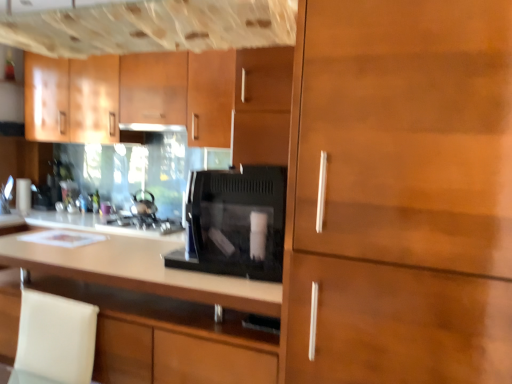
You are a GUI agent. You are given a task and a screenshot of the screen. Output one action in this format:
    pyautogui.click(x=<x>, y=<y>)
    Task: Click on the free spot below shiny metallic kettle at center (from a real-world perspective)
    This screenshot has height=384, width=512.
    Given the screenshot: What is the action you would take?
    pyautogui.click(x=148, y=216)